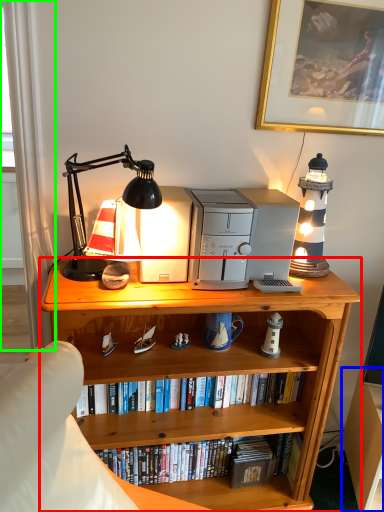
Question: Based on their relative distances, which object is nearer to bookcase (highlighted by a red box)? Choose from computer desk (highlighted by a blue box) and curtain (highlighted by a green box).

Choices:
 (A) computer desk
 (B) curtain

Answer: (A)